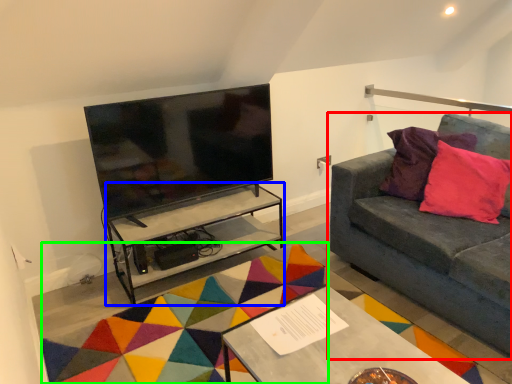
Question: Which object is positioned farthest from studio couch (highlighted by a red box)? Select from table (highlighted by a blue box) and mat (highlighted by a green box).

Choices:
 (A) table
 (B) mat

Answer: (A)